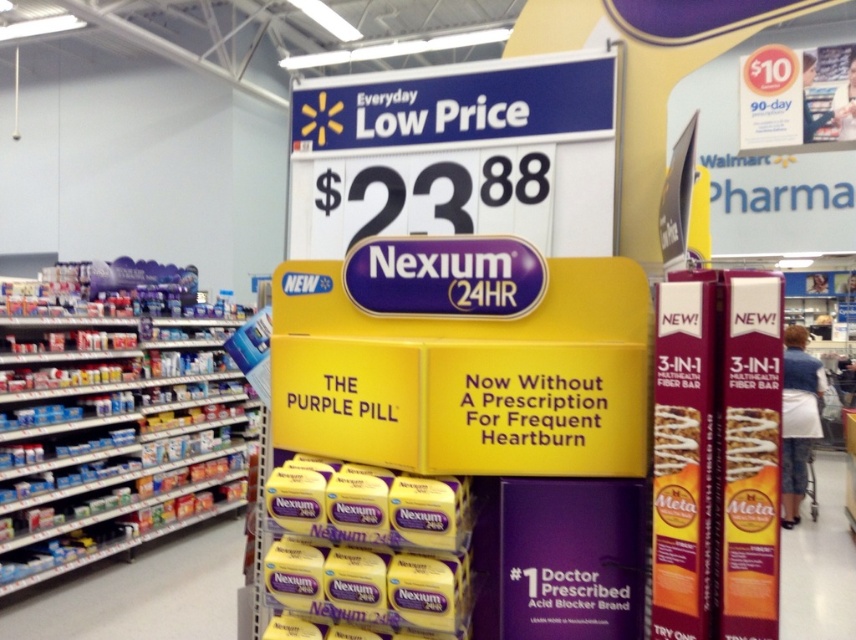
You are a Walmart employee who needs to place a new display that is 3 feet wide. You have space either next to the matte plastic shelves at left or the white fabric shopping cart at right. Based on their widths, which location can accommodate the display?

The matte plastic shelves at left have a larger width than the white fabric shopping cart at right, so the display can be placed next to the matte plastic shelves at left.

You are a customer in the Walmart pharmacy store. You see the Nexium 24HR promotional display and a point marked at coordinates (x=111, y=438). What is located at that point?

The point at coordinates (x=111, y=438) marks the location of matte plastic shelves at left.